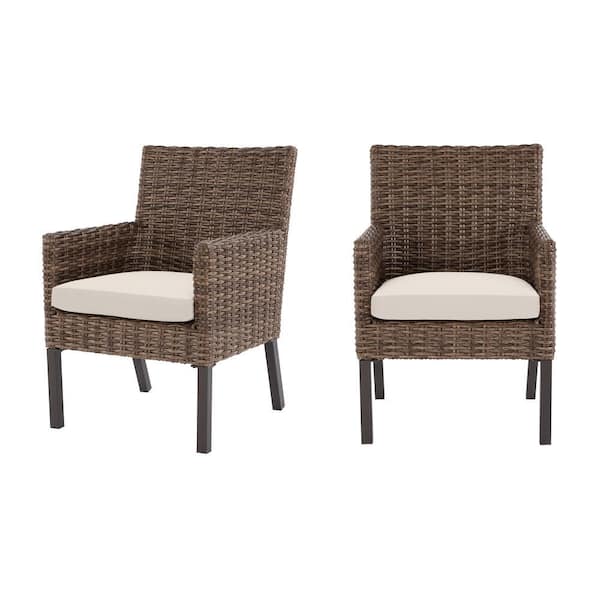
Identify the location of right side of chair. The width and height of the screenshot is (600, 600). (241, 302).